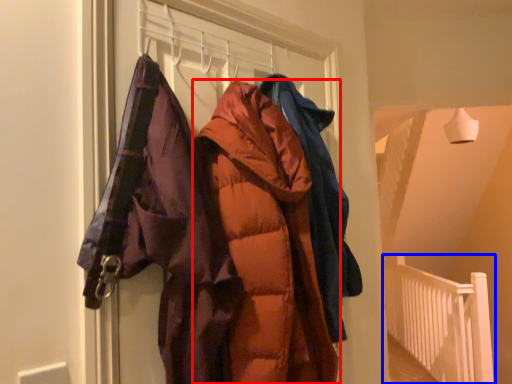
Question: Which object appears farthest to the camera in this image, jacket (highlighted by a red box) or balustrade (highlighted by a blue box)?

Choices:
 (A) jacket
 (B) balustrade

Answer: (B)